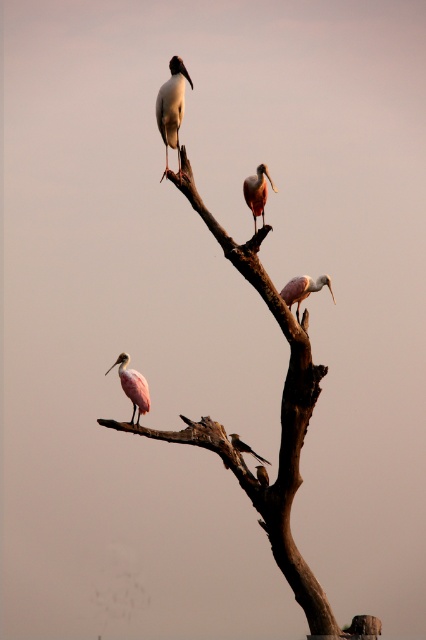
You are an ornithologist observing the birds on the deadwood tree. You notice the pink feathered spoonbill at center and the smooth pink spoonbill at lower center. Which of these two birds is positioned higher up on the tree?

The pink feathered spoonbill at center is taller than smooth pink spoonbill at lower center, so the pink feathered spoonbill at center is positioned higher up on the tree.

You are an ornithologist observing the tree. You notice the white glossy stork at upper center and the pink matte spoonbill at lower left. Which bird has a thicker body?

The pink matte spoonbill at lower left has a thicker body than the white glossy stork at upper center.

You are standing in front of the tree and want to reach both points labeled as point (262, 500) and point (255, 230). Which point will you reach first if you move towards them?

You will reach point (262, 500) first because it is closer to you than point (255, 230), which is further away.